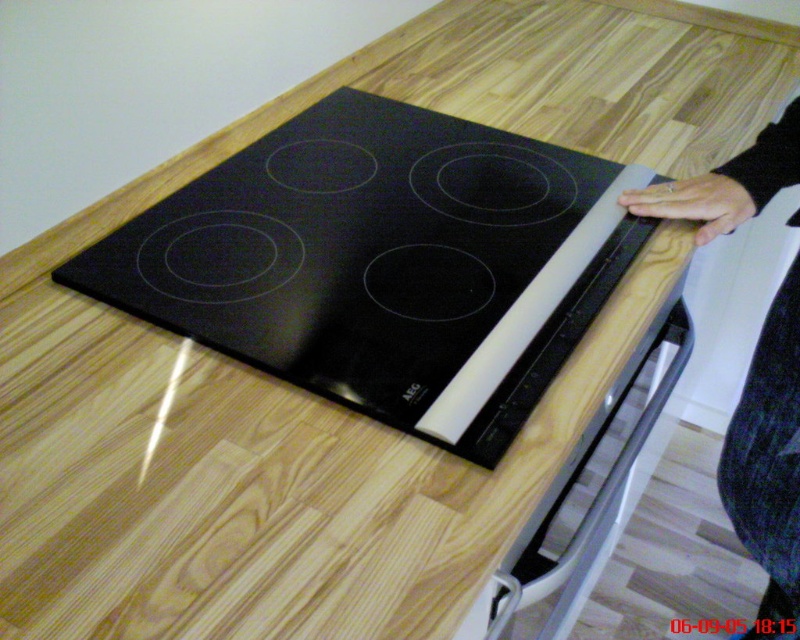
Is point (348, 120) behind point (788, 154)?

Yes, it is behind point (788, 154).

Between point (344, 392) and point (744, 428), which one is positioned in front?

Point (344, 392) is in front.

Describe the element at coordinates (385, 262) in the screenshot. I see `black glass cooktop at center` at that location.

I want to click on black glass cooktop at center, so click(385, 262).